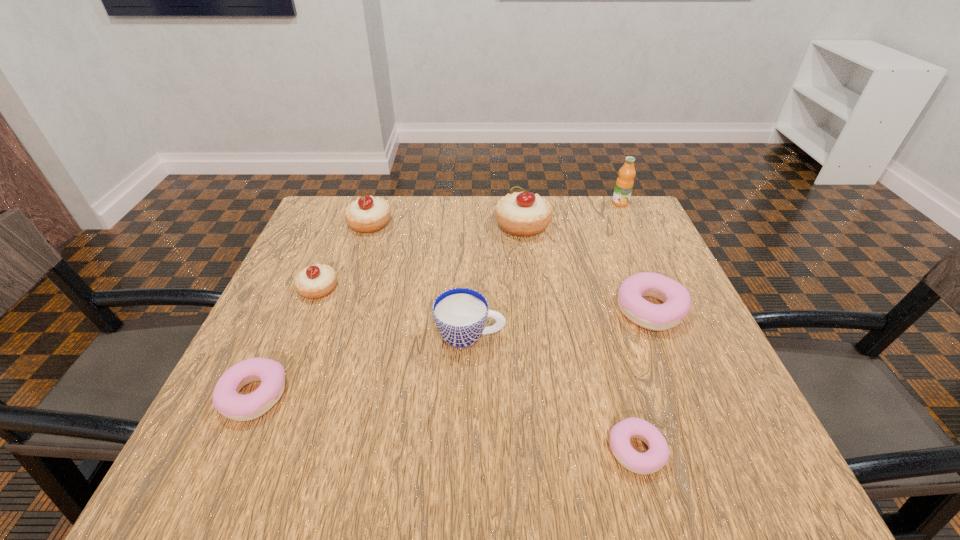
Find the location of a particular element. This screenshot has width=960, height=540. blank space located on the back of the second shortest object is located at coordinates (283, 332).

What are the coordinates of `vacant space located on the left of the smallest pink pastry` in the screenshot? It's located at (539, 450).

Where is `orange juice located in the far edge section of the desktop`? This screenshot has width=960, height=540. orange juice located in the far edge section of the desktop is located at coordinates (624, 184).

Where is `object that is at the near edge`? Image resolution: width=960 pixels, height=540 pixels. object that is at the near edge is located at coordinates (651, 461).

Find the location of a particular element. The width and height of the screenshot is (960, 540). orange juice that is at the right edge is located at coordinates (624, 184).

Where is `object that is at the far left corner`? The image size is (960, 540). object that is at the far left corner is located at coordinates (368, 214).

Locate an element on the screen. Image resolution: width=960 pixels, height=540 pixels. object that is positioned at the far right corner is located at coordinates (624, 184).

Image resolution: width=960 pixels, height=540 pixels. I want to click on object located in the near right corner section of the desktop, so click(x=651, y=461).

This screenshot has height=540, width=960. Find the location of `vacant position at the far edge of the desktop`. vacant position at the far edge of the desktop is located at coordinates [514, 245].

You are a GUI agent. You are given a task and a screenshot of the screen. Output one action in this format:
    pyautogui.click(x=<x>, y=<y>)
    Task: Click on the vacant space at the left edge of the desktop
    
    Given the screenshot: What is the action you would take?
    pyautogui.click(x=305, y=355)